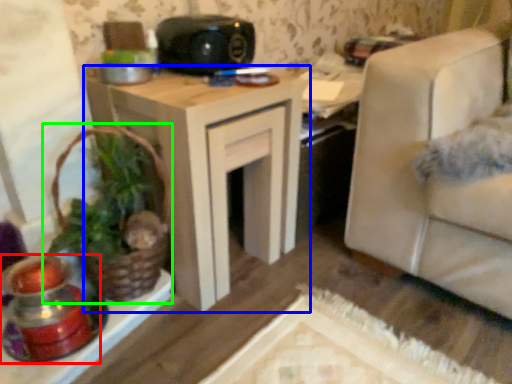
Question: Which is farther away from candle holder (highlighted by a red box)? table (highlighted by a blue box) or houseplant (highlighted by a green box)?

Choices:
 (A) table
 (B) houseplant

Answer: (A)